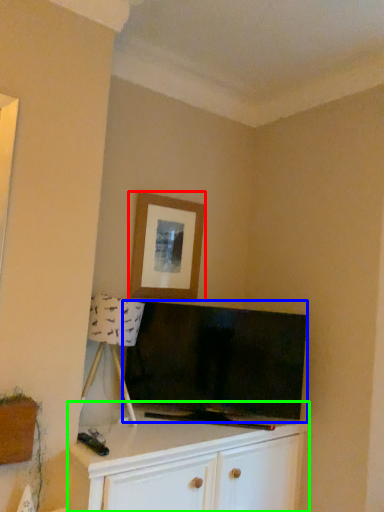
Question: Considering the real-world distances, which object is closest to picture frame (highlighted by a red box)? television (highlighted by a blue box) or cabinetry (highlighted by a green box).

Choices:
 (A) television
 (B) cabinetry

Answer: (A)